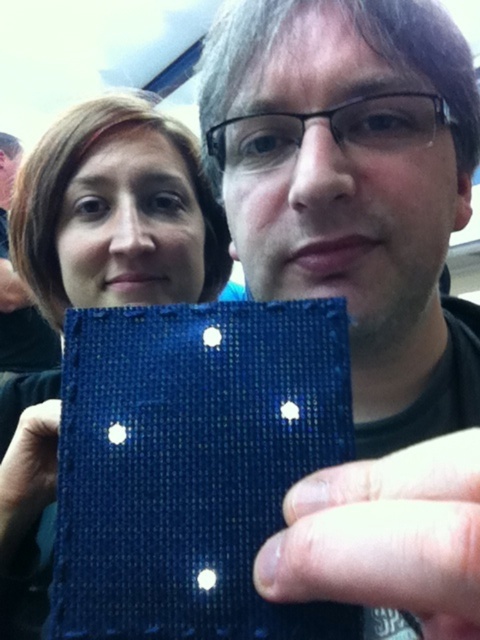
Question: Which point is farther from the camera taking this photo?

Choices:
 (A) (120, 131)
 (B) (300, 582)

Answer: (A)

Question: Is matte blue fabric at center to the left of blue fabric at center from the viewer's perspective?

Choices:
 (A) yes
 (B) no

Answer: (A)

Question: Which of the following is the farthest from the observer?

Choices:
 (A) matte blue fabric at center
 (B) blue fabric at center

Answer: (A)

Question: Does matte blue fabric at center come in front of blue fabric at center?

Choices:
 (A) no
 (B) yes

Answer: (A)

Question: Can you confirm if matte blue fabric at center is bigger than blue fabric at center?

Choices:
 (A) yes
 (B) no

Answer: (A)

Question: Which point is farther to the camera?

Choices:
 (A) (85, 134)
 (B) (476, 499)

Answer: (A)